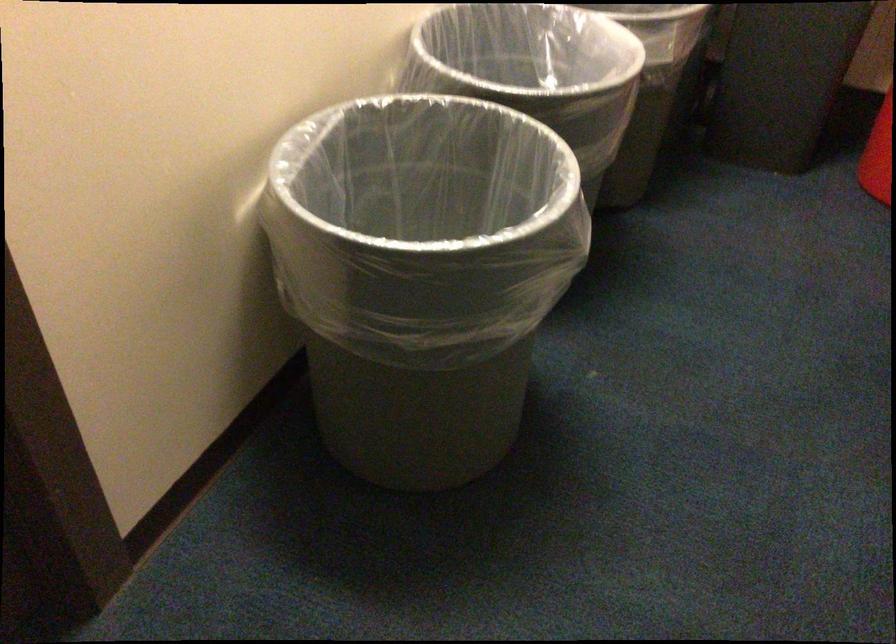
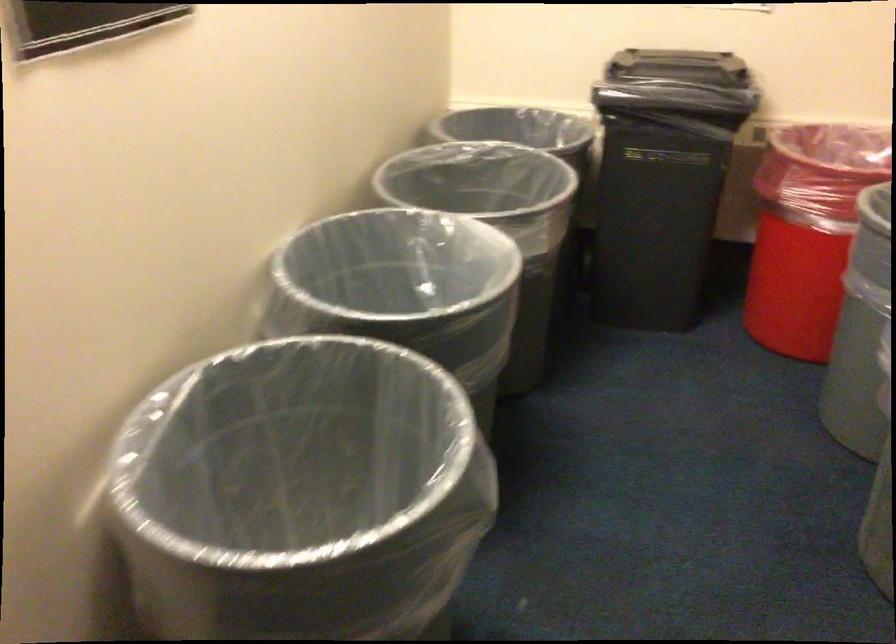
Question: How did the camera likely rotate?

Choices:
 (A) Left
 (B) Right
 (C) Up
 (D) Down

Answer: (C)